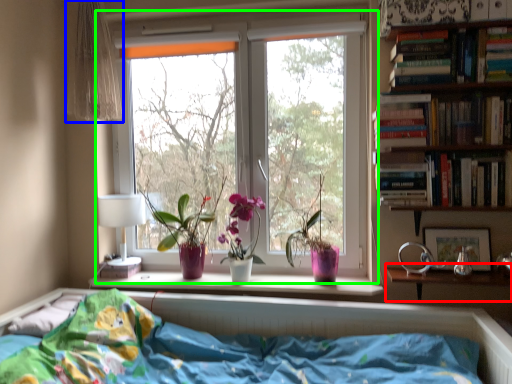
Question: Which object is the farthest from table (highlighted by a red box)? Choose among these: curtain (highlighted by a blue box) or window (highlighted by a green box).

Choices:
 (A) curtain
 (B) window

Answer: (A)